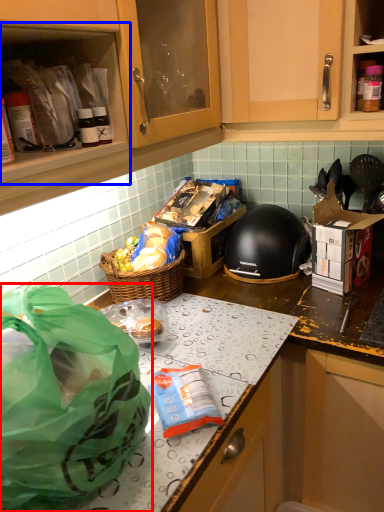
Question: Which object appears closest to the camera in this image, plastic bag (highlighted by a red box) or cabinetry (highlighted by a blue box)?

Choices:
 (A) plastic bag
 (B) cabinetry

Answer: (A)